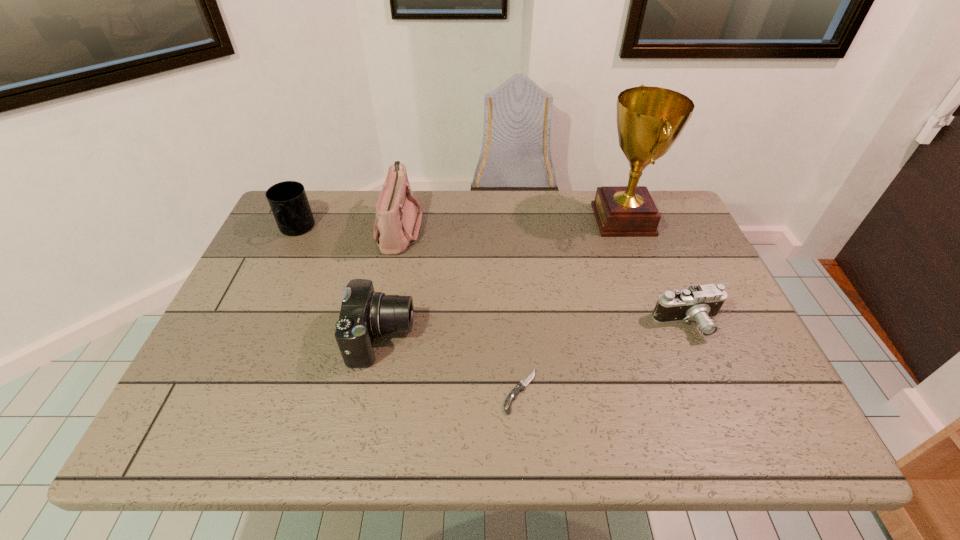
Identify the location of free region located 0.070m on the plaque of the tallest object. (570, 219).

The height and width of the screenshot is (540, 960). I want to click on free space located 0.140m on the front pocket of the fifth shortest object, so click(x=468, y=228).

You are a GUI agent. You are given a task and a screenshot of the screen. Output one action in this format:
    pyautogui.click(x=<x>, y=<y>)
    Task: Click on the vacant space located 0.340m on the side of the leftmost object with the handle
    
    Given the screenshot: What is the action you would take?
    pyautogui.click(x=245, y=340)

Find the location of a particular element. The height and width of the screenshot is (540, 960). vacant space located on the lens of the left camera is located at coordinates click(x=501, y=338).

Where is `free point located at the lens of the right camera`? This screenshot has height=540, width=960. free point located at the lens of the right camera is located at coordinates (716, 392).

In order to click on free region located on the left of the pocketknife in this screenshot , I will do `click(338, 391)`.

This screenshot has height=540, width=960. I want to click on award positioned at the far edge, so click(x=649, y=119).

Identify the location of shoulder bag at the far edge. (396, 227).

The height and width of the screenshot is (540, 960). Find the location of `mug at the far edge`. mug at the far edge is located at coordinates (288, 201).

This screenshot has height=540, width=960. I want to click on object at the near edge, so click(x=511, y=397).